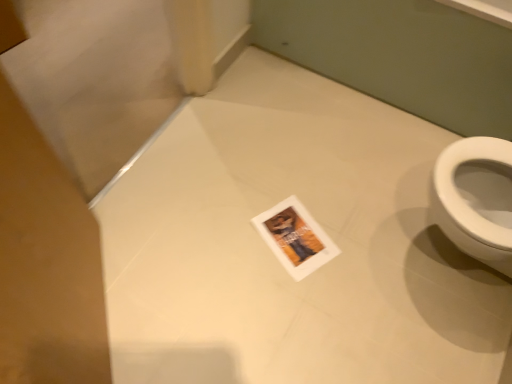
Where is `vacant space underneath white paper postcard at center (from a real-world perspective)`? vacant space underneath white paper postcard at center (from a real-world perspective) is located at coordinates (287, 235).